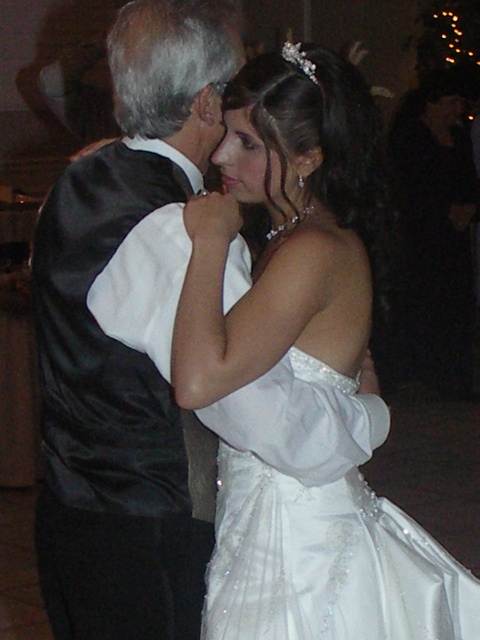
Question: Is satin black vest at left further to the viewer compared to satin/embroidered dress at center?

Choices:
 (A) no
 (B) yes

Answer: (B)

Question: Among these points, which one is farthest from the camera?

Choices:
 (A) tap(191, 561)
 (B) tap(326, 600)

Answer: (A)

Question: Is satin black vest at left thinner than satin/embroidered dress at center?

Choices:
 (A) no
 (B) yes

Answer: (B)

Question: Among these objects, which one is nearest to the camera?

Choices:
 (A) satin black vest at left
 (B) satin/embroidered dress at center

Answer: (B)

Question: Where is satin black vest at left located in relation to satin/embroidered dress at center in the image?

Choices:
 (A) above
 (B) below

Answer: (A)